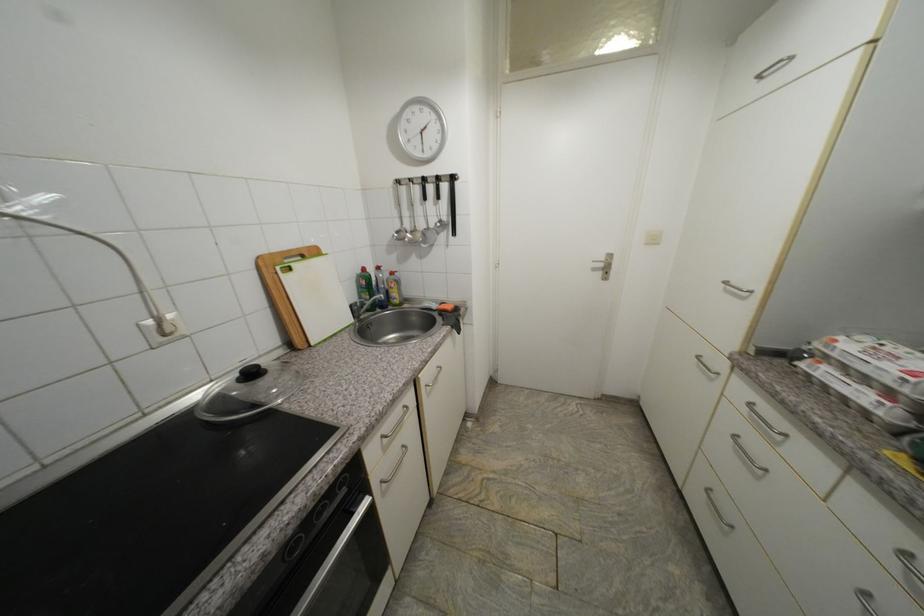
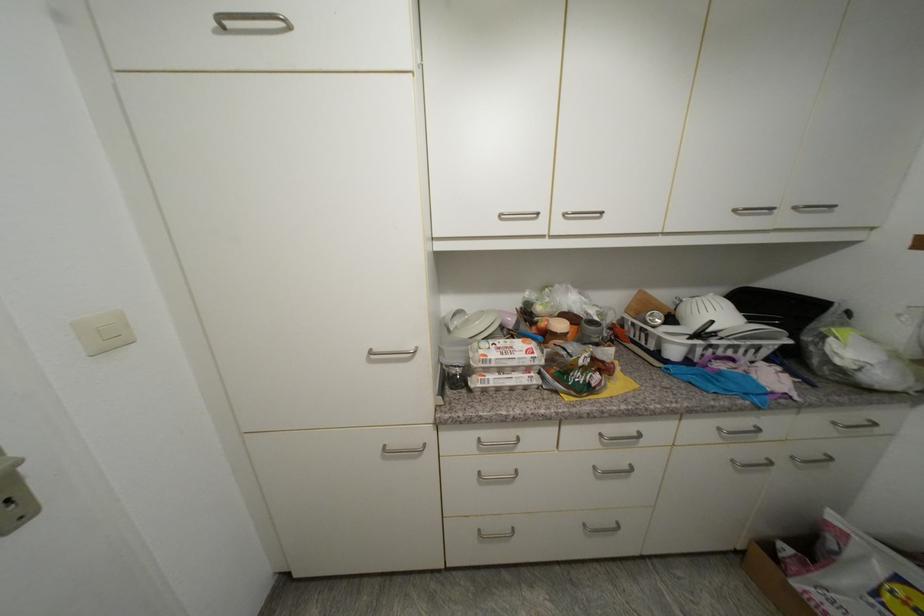
The point at (x=842, y=342) is marked in the first image. Where is the corresponding point in the second image?

(492, 357)